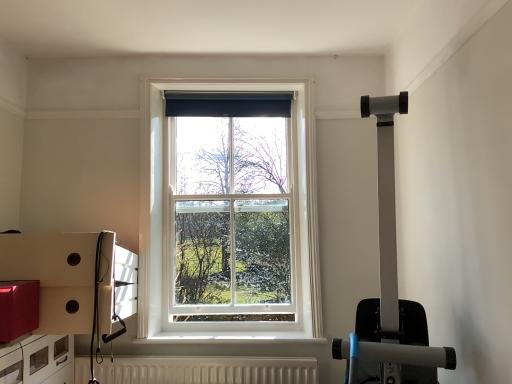
Question: From a real-world perspective, does white textured radiator at lower center sit lower than matte white drawer at lower left?

Choices:
 (A) no
 (B) yes

Answer: (B)

Question: Would you say matte white drawer at lower left is part of white textured radiator at lower center's contents?

Choices:
 (A) yes
 (B) no

Answer: (B)

Question: Does white textured radiator at lower center lie in front of matte white drawer at lower left?

Choices:
 (A) yes
 (B) no

Answer: (B)

Question: From the image's perspective, is white textured radiator at lower center located beneath matte white drawer at lower left?

Choices:
 (A) yes
 (B) no

Answer: (A)

Question: Considering the relative sizes of white textured radiator at lower center and matte white drawer at lower left in the image provided, is white textured radiator at lower center wider than matte white drawer at lower left?

Choices:
 (A) no
 (B) yes

Answer: (A)

Question: From a real-world perspective, is white textured radiator at lower center physically located above or below matte white drawer at lower left?

Choices:
 (A) below
 (B) above

Answer: (A)

Question: Is point (307, 364) positioned closer to the camera than point (71, 349)?

Choices:
 (A) closer
 (B) farther

Answer: (A)

Question: Is white textured radiator at lower center wider or thinner than matte white drawer at lower left?

Choices:
 (A) thin
 (B) wide

Answer: (A)

Question: Is white textured radiator at lower center taller or shorter than matte white drawer at lower left?

Choices:
 (A) short
 (B) tall

Answer: (A)

Question: Is point (314, 331) closer or farther from the camera than point (301, 362)?

Choices:
 (A) closer
 (B) farther

Answer: (B)

Question: From the image's perspective, is white wooden window at center located above or below white textured radiator at lower center?

Choices:
 (A) above
 (B) below

Answer: (A)

Question: From a real-world perspective, is white wooden window at center positioned above or below white textured radiator at lower center?

Choices:
 (A) below
 (B) above

Answer: (B)

Question: Is white wooden window at center bigger or smaller than white textured radiator at lower center?

Choices:
 (A) big
 (B) small

Answer: (A)

Question: From a real-world perspective, relative to white wooden window at center, is white textured radiator at lower center vertically above or below?

Choices:
 (A) above
 (B) below

Answer: (B)

Question: Is point (126, 357) closer or farther from the camera than point (155, 273)?

Choices:
 (A) farther
 (B) closer

Answer: (B)